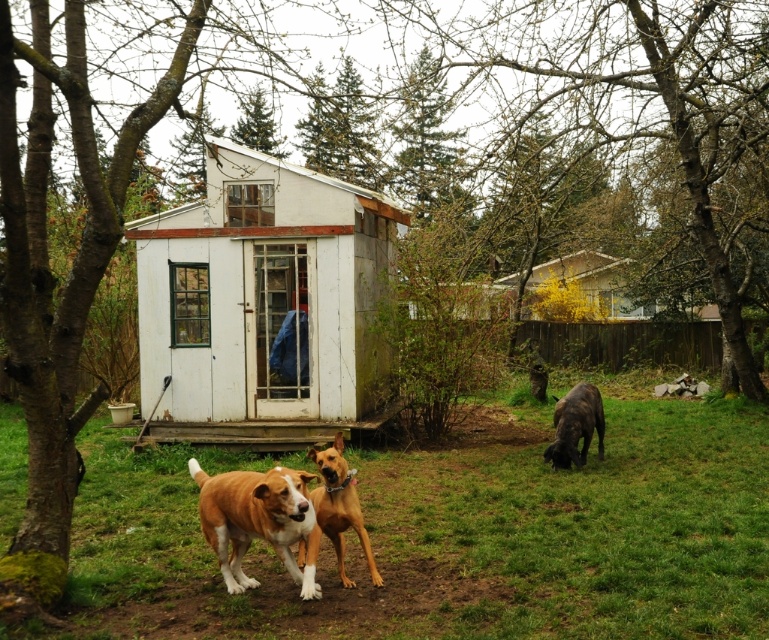
Question: Can you confirm if green grass at center is thinner than brown furry dog at lower left?

Choices:
 (A) yes
 (B) no

Answer: (B)

Question: Which point is closer to the camera?

Choices:
 (A) brown smooth dog at center
 (B) shiny black dog at lower right
 (C) yellow wood house at upper center

Answer: (A)

Question: Which object is positioned closest to the yellow wood house at upper center?

Choices:
 (A) brown smooth dog at center
 (B) white wood shed at center

Answer: (B)

Question: Which point appears closest to the camera in this image?

Choices:
 (A) (338, 440)
 (B) (554, 305)
 (C) (554, 512)
 (D) (208, 234)

Answer: (A)

Question: Considering the relative positions of brown smooth dog at center and shiny black dog at lower right in the image provided, where is brown smooth dog at center located with respect to shiny black dog at lower right?

Choices:
 (A) below
 (B) above

Answer: (B)

Question: Does brown smooth dog at center appear on the left side of shiny black dog at lower right?

Choices:
 (A) no
 (B) yes

Answer: (B)